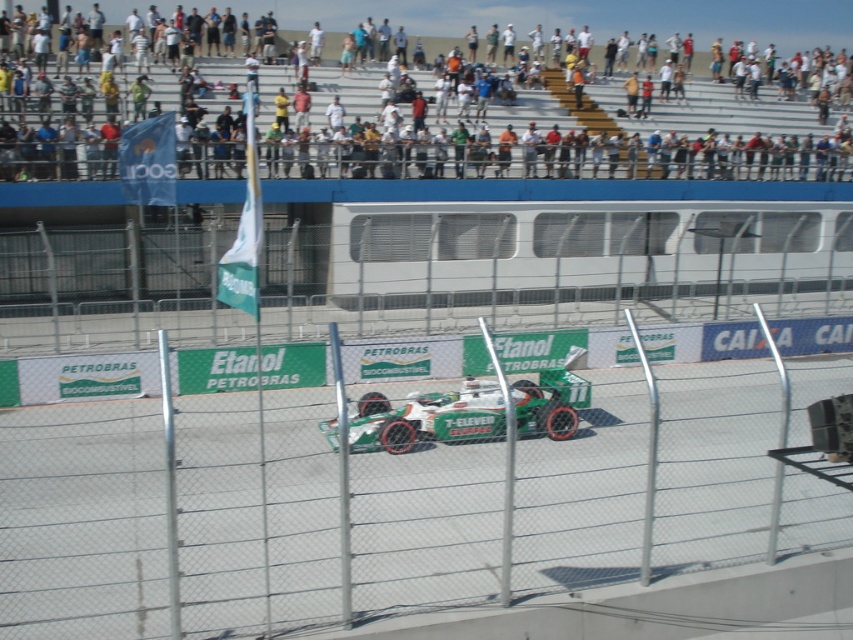
You are a photographer at the Formula One race. You have two cameras set up to capture the green racing car at center and the green matte race car at center. Which car should you focus on if you want to capture the larger vehicle?

The green racing car at center has a larger size compared to the green matte race car at center, so you should focus on the green racing car at center to capture the larger vehicle.